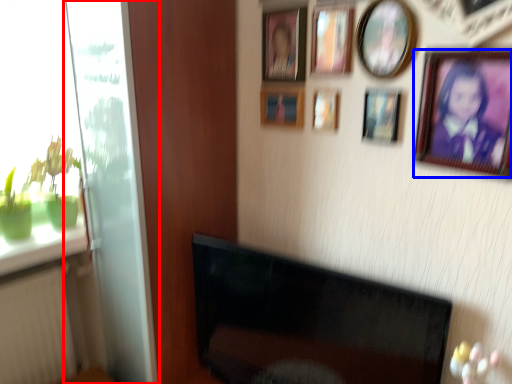
Question: Which object is closer to the camera taking this photo, glass door (highlighted by a red box) or picture frame (highlighted by a blue box)?

Choices:
 (A) glass door
 (B) picture frame

Answer: (B)